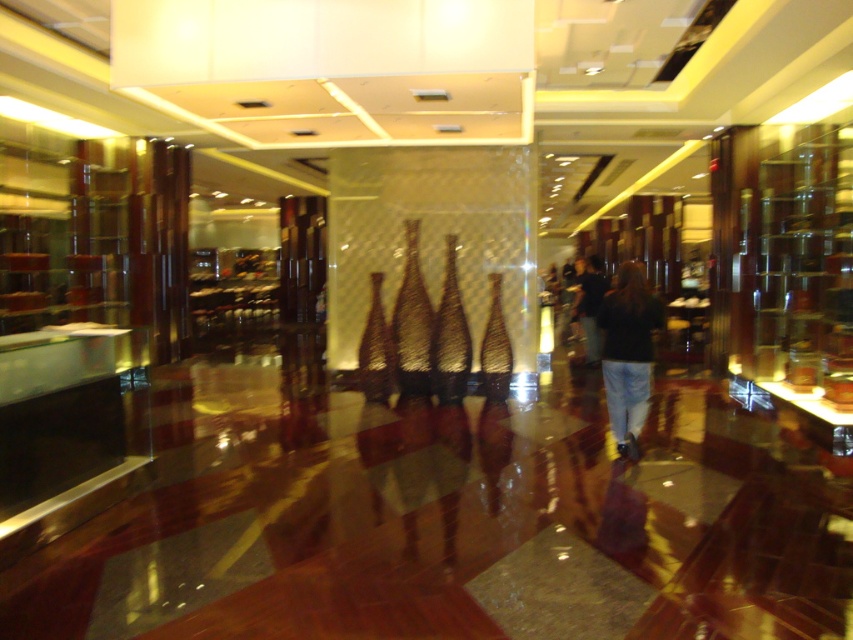
You are a customer in the store and want to see both the black denim jeans at center and the dark blue jeans at center. Which pair should you move closer to first to get a better look?

You should move closer to the black denim jeans at center first because it is in front of the dark blue jeans at center, so you can see it without obstruction.